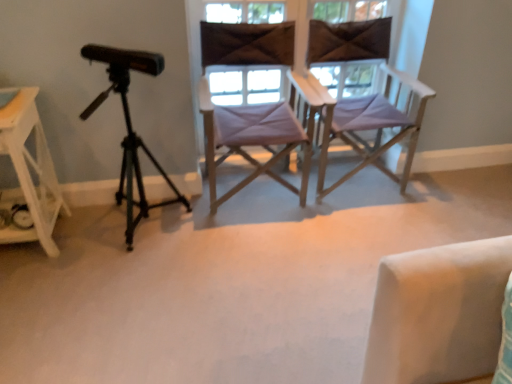
This screenshot has height=384, width=512. In order to click on vacant region to the left of black matte tripod at left in this screenshot , I will do `click(90, 236)`.